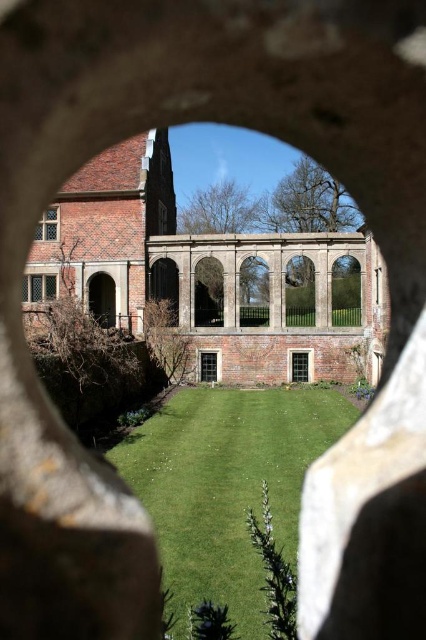
Question: Does matte glass window at lower left have a smaller size compared to green glass window at center?

Choices:
 (A) yes
 (B) no

Answer: (B)

Question: Does brick textured window at upper left come in front of matte black window at center?

Choices:
 (A) yes
 (B) no

Answer: (A)

Question: Which of the following is the farthest from the observer?

Choices:
 (A) (34, 300)
 (B) (224, 268)

Answer: (A)

Question: Among these objects, which one is nearest to the camera?

Choices:
 (A) brick textured window at upper left
 (B) brick wall at center
 (C) matte black window at center
 (D) green glass window at center

Answer: (A)

Question: Can you confirm if green glass window at center is positioned to the left of matte black window at center?

Choices:
 (A) no
 (B) yes

Answer: (A)

Question: Which point is farther to the camera?

Choices:
 (A) (216, 380)
 (B) (313, 232)
 (C) (256, 570)

Answer: (B)